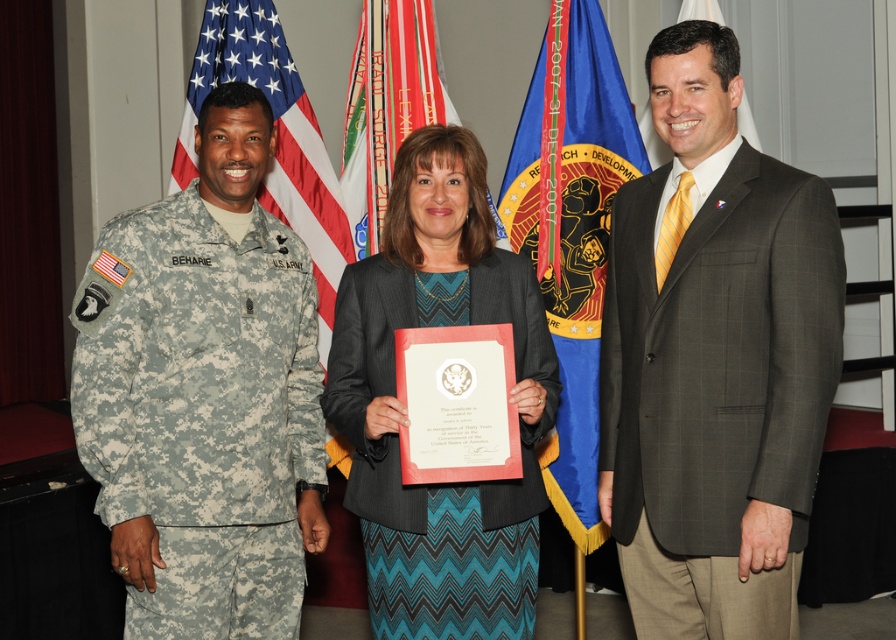
Question: Which point is farther to the camera?

Choices:
 (A) blue fabric flag at upper center
 (B) camouflage fabric uniform at center
 (C) dark gray textured suit at right

Answer: (A)

Question: Is american flag at left below blue fabric flag at upper center?

Choices:
 (A) yes
 (B) no

Answer: (A)

Question: Does camouflage fabric uniform at left have a greater width compared to camouflage fabric uniform at center?

Choices:
 (A) no
 (B) yes

Answer: (A)

Question: Is camouflage fabric uniform at center to the left of blue fabric flag at upper center from the viewer's perspective?

Choices:
 (A) yes
 (B) no

Answer: (A)

Question: Which point is farther from the camera taking this photo?

Choices:
 (A) (616, 93)
 (B) (376, 264)

Answer: (A)

Question: Considering the real-world distances, which object is farthest from the camouflage fabric uniform at left?

Choices:
 (A) blue fabric flag at upper center
 (B) camouflage fabric uniform at center
 (C) american flag at left
 (D) dark gray textured suit at right

Answer: (A)